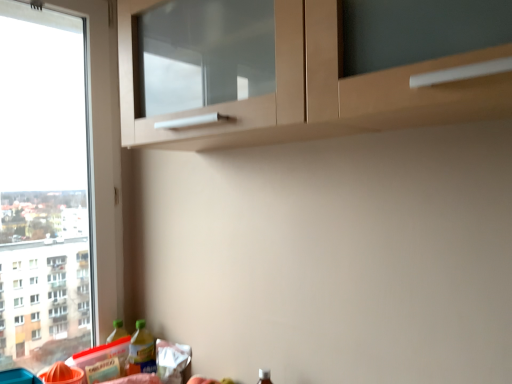
Question: Does translucent plastic bottle at lower left, the first bottle when ordered from right to left, have a larger size compared to translucent plastic bottle at lower left, the second bottle viewed from the right?

Choices:
 (A) yes
 (B) no

Answer: (A)

Question: Is translucent plastic bottle at lower left, the first bottle when ordered from right to left, to the left of translucent plastic bottle at lower left, the second bottle viewed from the right, from the viewer's perspective?

Choices:
 (A) no
 (B) yes

Answer: (A)

Question: From a real-world perspective, is translucent plastic bottle at lower left, arranged as the 2th bottle when viewed from the left, on top of translucent plastic bottle at lower left, which is counted as the first bottle, starting from the left?

Choices:
 (A) yes
 (B) no

Answer: (B)

Question: Considering the relative sizes of translucent plastic bottle at lower left, the first bottle when ordered from right to left, and translucent plastic bottle at lower left, the second bottle viewed from the right, in the image provided, is translucent plastic bottle at lower left, the first bottle when ordered from right to left, wider than translucent plastic bottle at lower left, the second bottle viewed from the right,?

Choices:
 (A) yes
 (B) no

Answer: (B)

Question: From the image's perspective, is translucent plastic bottle at lower left, arranged as the 2th bottle when viewed from the left, above translucent plastic bottle at lower left, the second bottle viewed from the right?

Choices:
 (A) yes
 (B) no

Answer: (A)

Question: Is translucent plastic bottle at lower left, the first bottle when ordered from right to left, smaller than translucent plastic bottle at lower left, the second bottle viewed from the right?

Choices:
 (A) no
 (B) yes

Answer: (A)

Question: Would you consider translucent plastic bottle at lower left, which is counted as the first bottle, starting from the left, to be distant from translucent plastic bottle at lower left, arranged as the 2th bottle when viewed from the left?

Choices:
 (A) no
 (B) yes

Answer: (A)

Question: Does translucent plastic bottle at lower left, which is counted as the first bottle, starting from the left, come behind translucent plastic bottle at lower left, the first bottle when ordered from right to left?

Choices:
 (A) yes
 (B) no

Answer: (A)

Question: From the image's perspective, is translucent plastic bottle at lower left, which is counted as the first bottle, starting from the left, located beneath translucent plastic bottle at lower left, arranged as the 2th bottle when viewed from the left?

Choices:
 (A) no
 (B) yes

Answer: (B)

Question: Can you confirm if translucent plastic bottle at lower left, which is counted as the first bottle, starting from the left, is positioned to the right of translucent plastic bottle at lower left, the first bottle when ordered from right to left?

Choices:
 (A) no
 (B) yes

Answer: (A)

Question: Can you confirm if translucent plastic bottle at lower left, the second bottle viewed from the right, is taller than translucent plastic bottle at lower left, the first bottle when ordered from right to left?

Choices:
 (A) no
 (B) yes

Answer: (B)

Question: Is translucent plastic bottle at lower left, which is counted as the first bottle, starting from the left, aimed at translucent plastic bottle at lower left, arranged as the 2th bottle when viewed from the left?

Choices:
 (A) no
 (B) yes

Answer: (A)

Question: In the image, is translucent plastic bottle at lower left, the second bottle viewed from the right, on the left side or the right side of translucent plastic bottle at lower left, arranged as the 2th bottle when viewed from the left?

Choices:
 (A) left
 (B) right

Answer: (A)